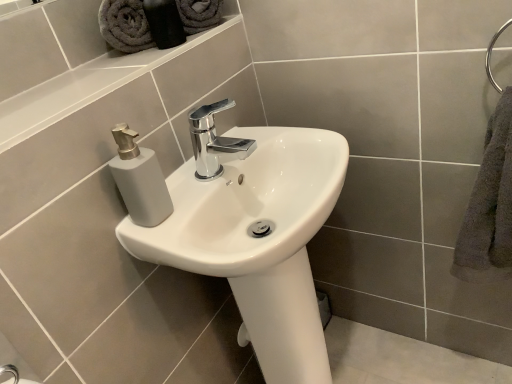
Identify the location of free area behind chrome metallic faucet at center. (230, 145).